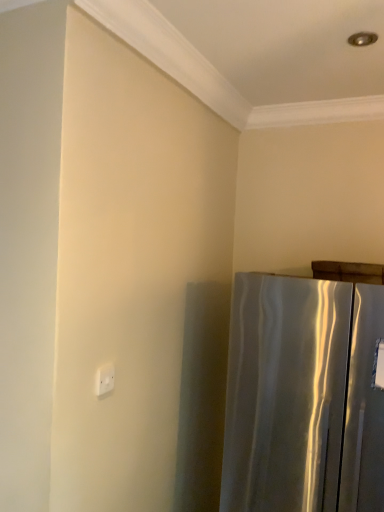
The image size is (384, 512). What do you see at coordinates (104, 379) in the screenshot?
I see `white plastic electric outlet at upper left` at bounding box center [104, 379].

Locate an element on the screen. white plastic electric outlet at upper left is located at coordinates point(104,379).

What is the approximate width of white plastic electric outlet at upper left?

It is 2.69 centimeters.

Where is `satin silver refrigerator at right`? This screenshot has width=384, height=512. satin silver refrigerator at right is located at coordinates (303, 396).

Image resolution: width=384 pixels, height=512 pixels. Describe the element at coordinates (303, 396) in the screenshot. I see `satin silver refrigerator at right` at that location.

Measure the distance between point (310, 444) and camera.

1.58 meters.

Find the location of a particular element. The width and height of the screenshot is (384, 512). white plastic electric outlet at upper left is located at coordinates (104, 379).

In the scene shown: Based on their positions, is satin silver refrigerator at right located to the left or right of white plastic electric outlet at upper left?

satin silver refrigerator at right is to the right of white plastic electric outlet at upper left.

Which object is further away from the camera, satin silver refrigerator at right or white plastic electric outlet at upper left?

white plastic electric outlet at upper left is further from the camera.

Which is in front, point (251, 488) or point (100, 379)?

Positioned in front is point (100, 379).

From the image's perspective, who appears lower, satin silver refrigerator at right or white plastic electric outlet at upper left?

satin silver refrigerator at right is shown below in the image.

From a real-world perspective, is satin silver refrigerator at right below white plastic electric outlet at upper left?

Yes, from a real-world perspective, satin silver refrigerator at right is beneath white plastic electric outlet at upper left.

Can you confirm if satin silver refrigerator at right is wider than white plastic electric outlet at upper left?

Indeed, satin silver refrigerator at right has a greater width compared to white plastic electric outlet at upper left.

Does satin silver refrigerator at right have a lesser height compared to white plastic electric outlet at upper left?

No.

Who is smaller, satin silver refrigerator at right or white plastic electric outlet at upper left?

white plastic electric outlet at upper left.

Would you say satin silver refrigerator at right contains white plastic electric outlet at upper left?

No.

Is the surface of satin silver refrigerator at right in direct contact with white plastic electric outlet at upper left?

No.

Is satin silver refrigerator at right facing away from white plastic electric outlet at upper left?

That's not correct — satin silver refrigerator at right is not looking away from white plastic electric outlet at upper left.

How different are the orientations of satin silver refrigerator at right and white plastic electric outlet at upper left in degrees?

satin silver refrigerator at right and white plastic electric outlet at upper left are facing 91.8 degrees away from each other.

Identify the location of refrigerator below the white plastic electric outlet at upper left (from a real-world perspective). The height and width of the screenshot is (512, 384). (303, 396).

Which is more to the right, white plastic electric outlet at upper left or satin silver refrigerator at right?

satin silver refrigerator at right is more to the right.

Considering their positions, is white plastic electric outlet at upper left located in front of or behind satin silver refrigerator at right?

white plastic electric outlet at upper left is positioned farther from the viewer than satin silver refrigerator at right.

Is point (112, 387) more distant than point (317, 397)?

No, it is not.

From the image's perspective, which one is positioned lower, white plastic electric outlet at upper left or satin silver refrigerator at right?

satin silver refrigerator at right is shown below in the image.

From a real-world perspective, is white plastic electric outlet at upper left located higher than satin silver refrigerator at right?

Yes, from a real-world perspective, white plastic electric outlet at upper left is above satin silver refrigerator at right.

In terms of width, does white plastic electric outlet at upper left look wider or thinner when compared to satin silver refrigerator at right?

Considering their sizes, white plastic electric outlet at upper left looks slimmer than satin silver refrigerator at right.

Which of these two, white plastic electric outlet at upper left or satin silver refrigerator at right, stands taller?

With more height is satin silver refrigerator at right.

Can you confirm if white plastic electric outlet at upper left is smaller than satin silver refrigerator at right?

Correct, white plastic electric outlet at upper left occupies less space than satin silver refrigerator at right.

Is satin silver refrigerator at right completely or partially inside white plastic electric outlet at upper left?

No, white plastic electric outlet at upper left does not contain satin silver refrigerator at right.

Would you say white plastic electric outlet at upper left is a long distance from satin silver refrigerator at right?

white plastic electric outlet at upper left is actually quite close to satin silver refrigerator at right.

Is white plastic electric outlet at upper left oriented away from satin silver refrigerator at right?

No.

How distant is white plastic electric outlet at upper left from satin silver refrigerator at right?

29.01 inches.

What are the coordinates of `refrigerator in front of the white plastic electric outlet at upper left` in the screenshot? It's located at (303, 396).

The image size is (384, 512). Find the location of `electric outlet behind the satin silver refrigerator at right`. electric outlet behind the satin silver refrigerator at right is located at coordinates (104, 379).

What are the coordinates of `refrigerator lying in front of the white plastic electric outlet at upper left` in the screenshot? It's located at (303, 396).